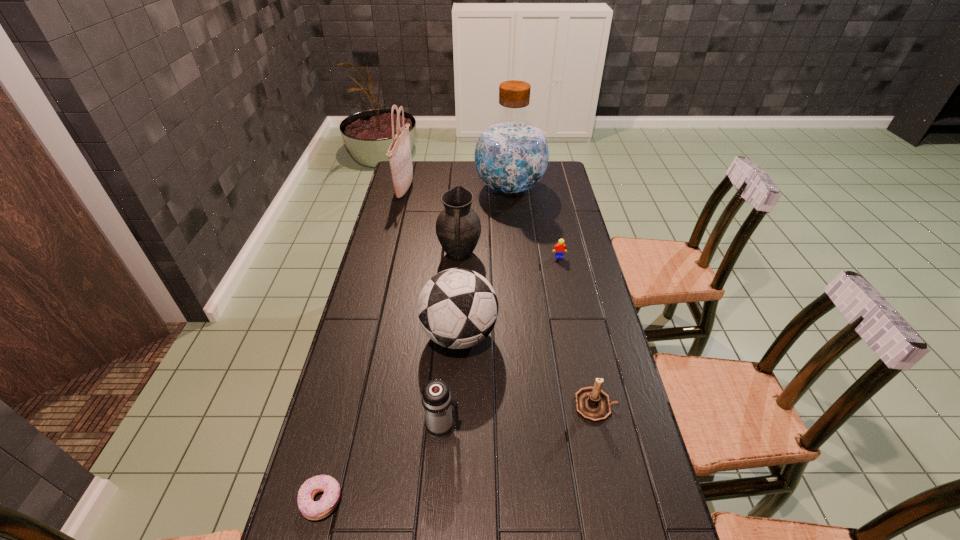
Where is `doughnut present at the left edge`? This screenshot has height=540, width=960. doughnut present at the left edge is located at coordinates (317, 510).

Identify the location of water jug that is at the right edge. The width and height of the screenshot is (960, 540). (511, 155).

At what (x,y) coordinates should I click in order to perform the action: click on candle holder that is positioned at the right edge. Please return your answer as a coordinate pair (x, y). Image resolution: width=960 pixels, height=540 pixels. Looking at the image, I should click on (593, 404).

Locate an element on the screen. Lego present at the right edge is located at coordinates (560, 248).

The width and height of the screenshot is (960, 540). Identify the location of object located at the far left corner. (400, 159).

At what (x,y) coordinates should I click in order to perform the action: click on object located in the far right corner section of the desktop. Please return your answer as a coordinate pair (x, y). Image resolution: width=960 pixels, height=540 pixels. Looking at the image, I should click on (511, 155).

In the image, there is a desktop. In order to click on vacant area at the far edge in this screenshot , I will do `click(463, 167)`.

Identify the location of vacant space at the left edge of the desktop. [387, 369].

At what (x,y) coordinates should I click in order to perform the action: click on free region at the right edge. Please return your answer as a coordinate pair (x, y). Looking at the image, I should click on (636, 535).

The image size is (960, 540). I want to click on free space at the far left corner, so click(427, 177).